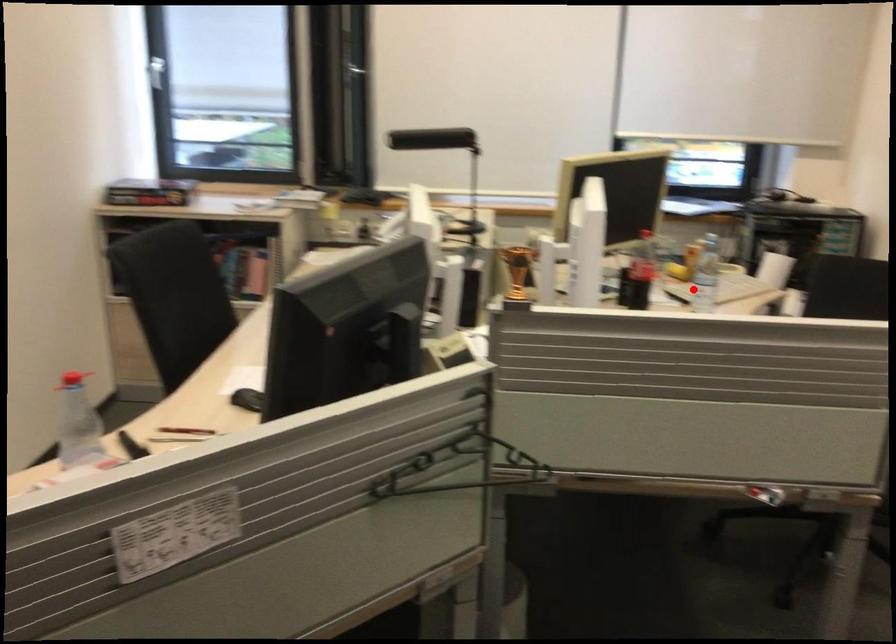
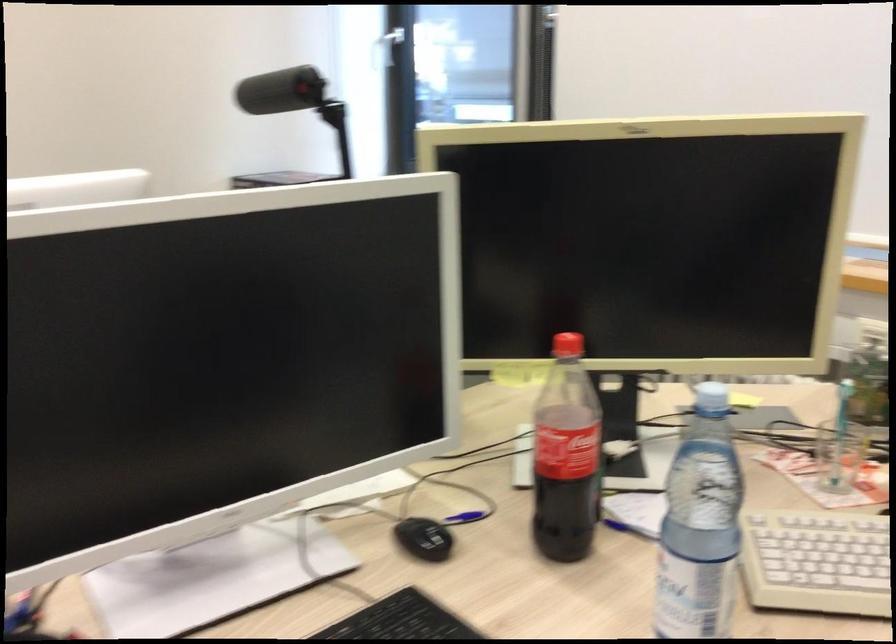
Question: I am providing you with two images of the same scene from different viewpoints. In image1, a red point is highlighted. Considering the same 3D point in image2, which of the following is correct?

Choices:
 (A) It is closer
 (B) It is farther

Answer: (A)